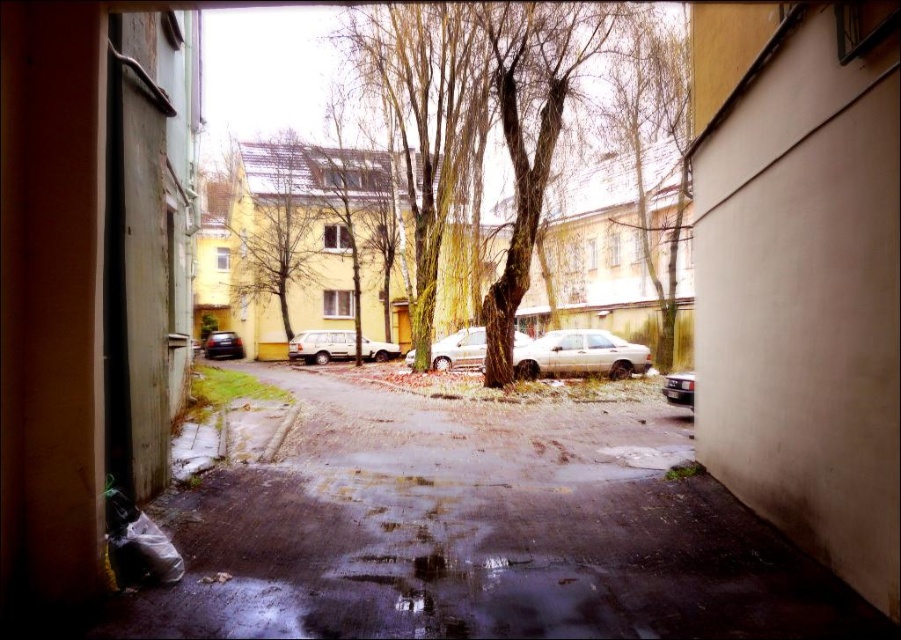
Question: Can you confirm if smooth asphalt road at center is smaller than shiny black car at center?

Choices:
 (A) no
 (B) yes

Answer: (A)

Question: Can you confirm if smooth asphalt road at center is thinner than shiny black car at center?

Choices:
 (A) yes
 (B) no

Answer: (B)

Question: Which point is farther to the camera?

Choices:
 (A) green leafy tree at upper center
 (B) shiny black car at center

Answer: (B)

Question: Is silver metallic sedan at center bigger than shiny silver car at right?

Choices:
 (A) no
 (B) yes

Answer: (A)

Question: Which point is closer to the camera?

Choices:
 (A) shiny silver car at right
 (B) yellow matte suv at center
 (C) smooth asphalt road at center
 (D) green leafy tree at upper center

Answer: (C)

Question: Which object is the closest to the green leafy tree at upper center?

Choices:
 (A) yellow matte suv at center
 (B) shiny black car at center
 (C) silver metallic sedan at center

Answer: (C)